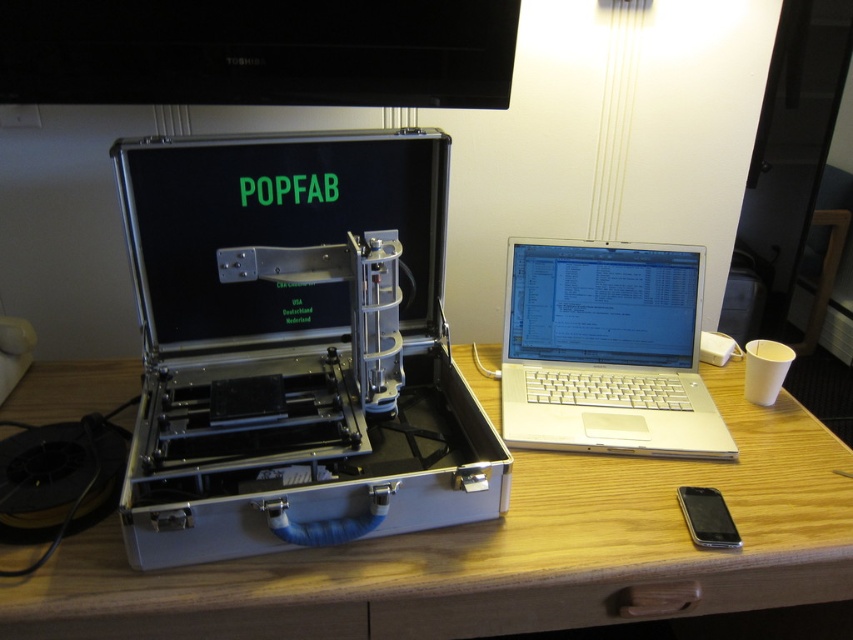
Is wooden table at center positioned before silver metallic laptop at center?

Yes.

Between wooden table at center and silver metallic laptop at center, which one appears on the left side from the viewer's perspective?

Positioned to the left is wooden table at center.

Is point (619, 588) closer to camera compared to point (699, 248)?

That is True.

Locate an element on the screen. The width and height of the screenshot is (853, 640). wooden table at center is located at coordinates (502, 554).

Is silver metallic case at center bigger than wooden table at center?

No, silver metallic case at center is not bigger than wooden table at center.

Is point (293, 328) in front of point (782, 556)?

No, (293, 328) is further to viewer.

In order to click on silver metallic case at center in this screenshot , I will do `click(294, 346)`.

Is silver metallic case at center thinner than silver metallic laptop at center?

No.

Is silver metallic case at center above silver metallic laptop at center?

Correct, silver metallic case at center is located above silver metallic laptop at center.

Where is `silver metallic case at center`? silver metallic case at center is located at coordinates (294, 346).